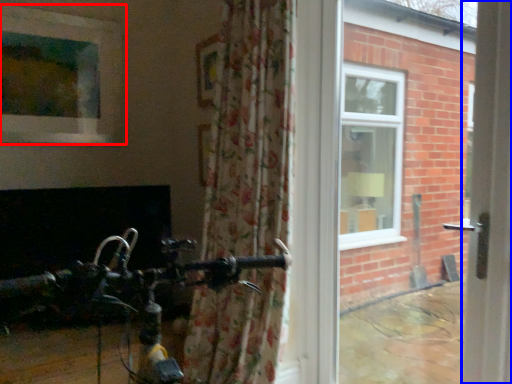
Question: Among these objects, which one is nearest to the camera, window (highlighted by a red box) or screen door (highlighted by a blue box)?

Choices:
 (A) window
 (B) screen door

Answer: (B)